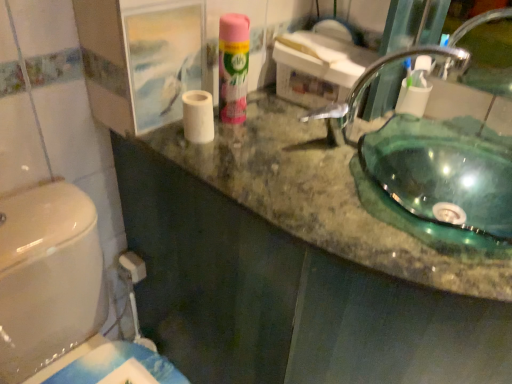
Locate an element on the screen. The width and height of the screenshot is (512, 384). vacant area that is in front of pink matte air freshener at upper center is located at coordinates (240, 153).